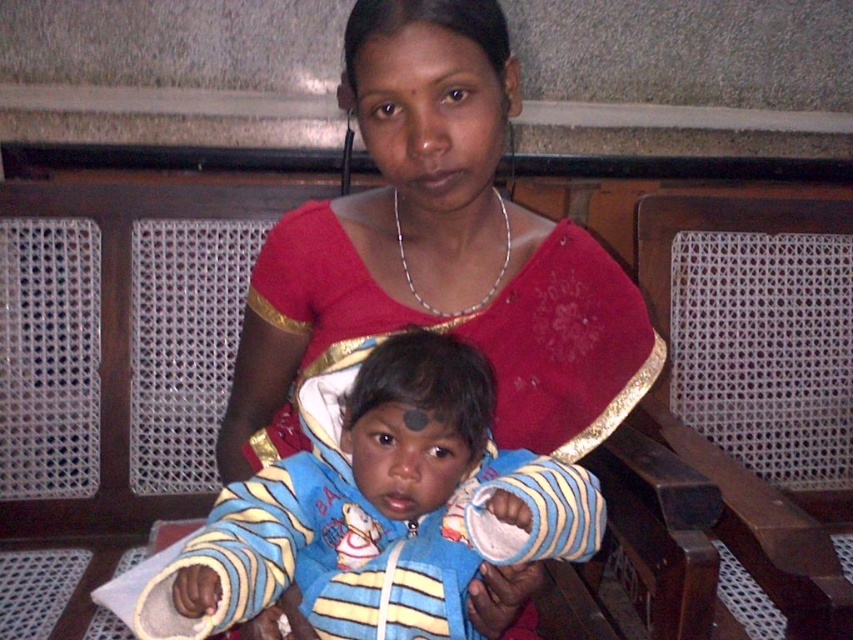
Question: Which point is closer to the camera?

Choices:
 (A) (262, 636)
 (B) (427, 392)

Answer: (B)

Question: Is matte red blouse at center positioned before blue striped fabric at center?

Choices:
 (A) yes
 (B) no

Answer: (B)

Question: Is matte red blouse at center wider than blue striped fabric at center?

Choices:
 (A) no
 (B) yes

Answer: (B)

Question: Is matte red blouse at center positioned behind blue striped fabric at center?

Choices:
 (A) no
 (B) yes

Answer: (B)